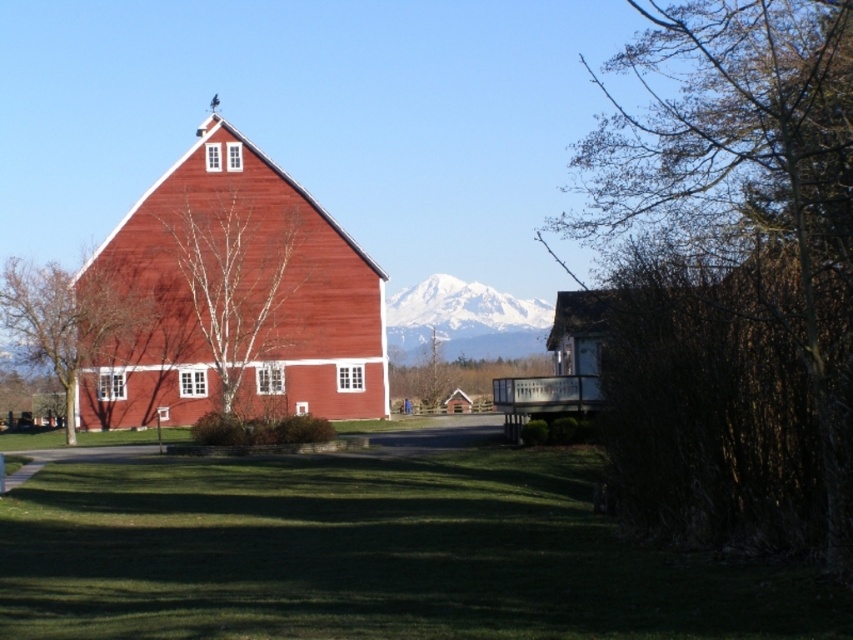
Question: Among these objects, which one is nearest to the camera?

Choices:
 (A) bare branches at upper right
 (B) bare branches at left
 (C) bare birch tree at center

Answer: (A)

Question: Which point appears closest to the camera in this image?

Choices:
 (A) (201, 257)
 (B) (695, 188)

Answer: (B)

Question: Does bare branches at upper right come behind matte wood barn at center?

Choices:
 (A) yes
 (B) no

Answer: (B)

Question: Can you confirm if matte wood barn at center is positioned to the left of bare branches at left?

Choices:
 (A) yes
 (B) no

Answer: (B)

Question: From the image, what is the correct spatial relationship of matte wood barn at center in relation to bare birch tree at center?

Choices:
 (A) below
 (B) above

Answer: (B)

Question: Which point is closer to the camera?

Choices:
 (A) snowy peak at center
 (B) bare branches at upper right
 (C) matte wood barn at center

Answer: (B)